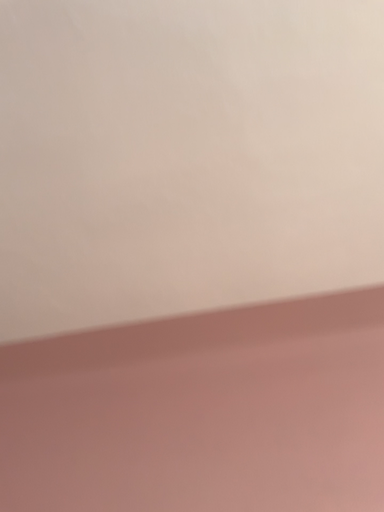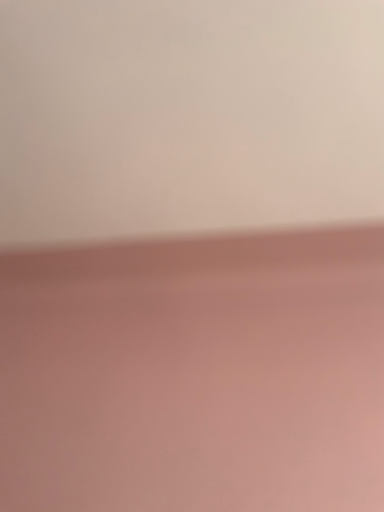
Question: How did the camera likely rotate when shooting the video?

Choices:
 (A) rotated upward
 (B) rotated downward

Answer: (B)